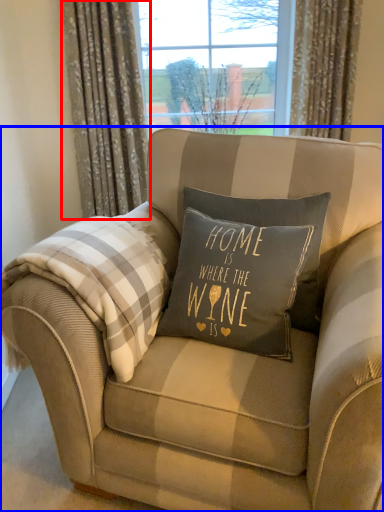
Question: Which object appears farthest to the camera in this image, curtain (highlighted by a red box) or chair (highlighted by a blue box)?

Choices:
 (A) curtain
 (B) chair

Answer: (A)